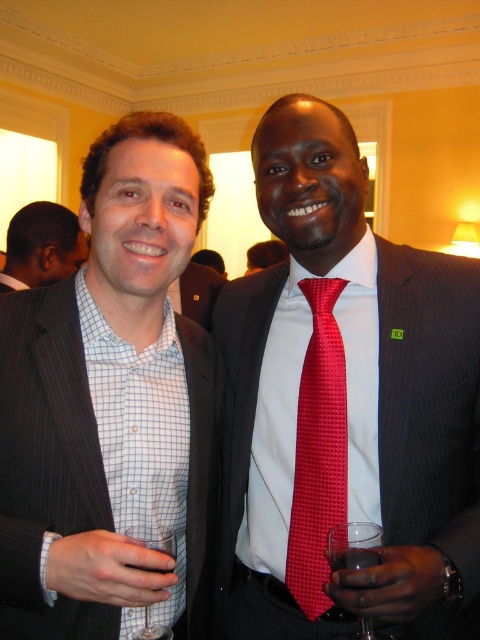
Is red textured tie at center above matte black suit at upper left?

No.

Between point (330, 285) and point (67, 273), which one is positioned behind?

The point (67, 273) is more distant.

Between point (297, 435) and point (26, 278), which one is positioned in front?

Point (297, 435) is more forward.

This screenshot has height=640, width=480. I want to click on red textured tie at center, so click(317, 451).

Looking at this image, is matte red tie at center to the right of matte black suit at upper left from the viewer's perspective?

Correct, you'll find matte red tie at center to the right of matte black suit at upper left.

Between point (288, 541) and point (22, 237), which one is positioned behind?

The point (22, 237) is behind.

Between point (239, 490) and point (45, 282), which one is positioned behind?

The point (45, 282) is behind.

The height and width of the screenshot is (640, 480). Identify the location of matte red tie at center. (346, 403).

Does point (0, 538) come in front of point (372, 540)?

No, (0, 538) is behind (372, 540).

Describe the element at coordinates (110, 404) in the screenshot. I see `matte black suit at center` at that location.

Where is `matte black suit at center`? The image size is (480, 640). matte black suit at center is located at coordinates coord(110,404).